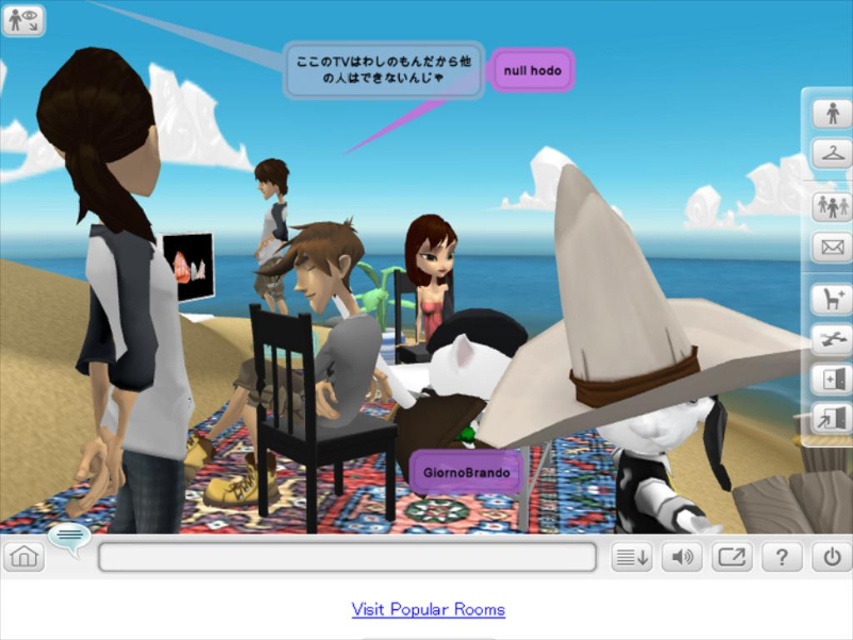
Question: Where is matte gray shirt at center located in relation to smooth pink dress at center in the image?

Choices:
 (A) right
 (B) left

Answer: (B)

Question: Which object is farther from the camera taking this photo?

Choices:
 (A) matte gray shirt at center
 (B) smooth pink dress at center
 (C) light brown fabric shirt at center
 (D) white matte dress at left

Answer: (C)

Question: Which object is positioned farthest from the matte gray shirt at center?

Choices:
 (A) white matte dress at left
 (B) light brown fabric shirt at center

Answer: (B)

Question: Where is white matte dress at left located in relation to smooth pink dress at center in the image?

Choices:
 (A) below
 (B) above

Answer: (B)

Question: Can you confirm if white matte dress at left is positioned above matte gray shirt at center?

Choices:
 (A) yes
 (B) no

Answer: (A)

Question: Among these objects, which one is farthest from the camera?

Choices:
 (A) white matte dress at left
 (B) light brown fabric shirt at center
 (C) matte gray shirt at center

Answer: (B)